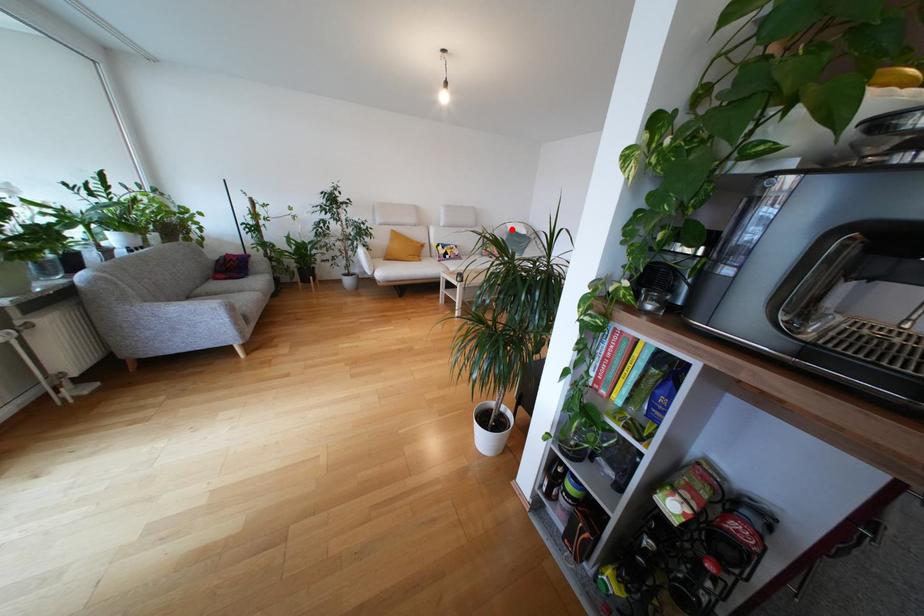
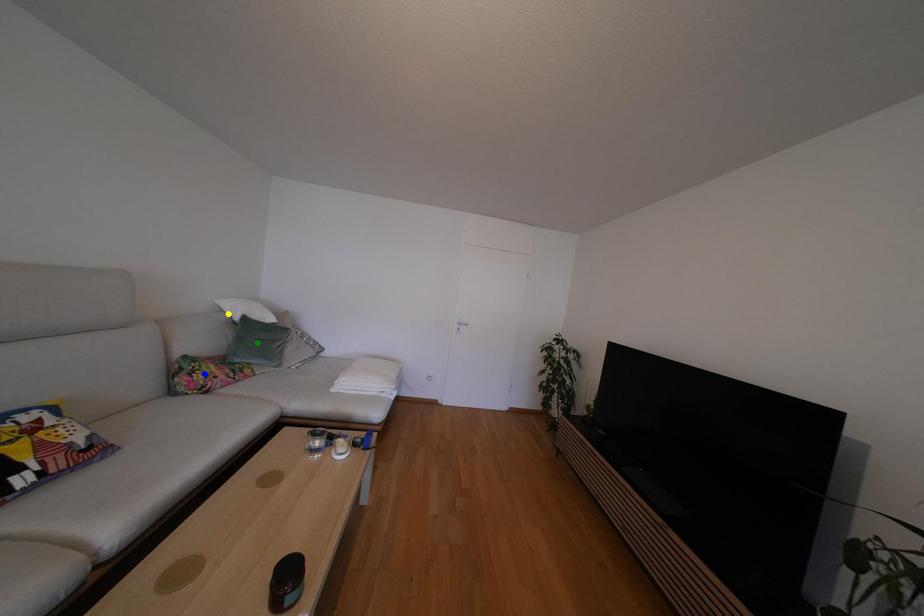
Question: I am providing you with two images of the same scene from different viewpoints. A red point is marked on the first image. You are given multiple points on the second image. Which point in image 2 is actually the same real-world point as the red point in image 1?

Choices:
 (A) blue point
 (B) yellow point
 (C) green point

Answer: (B)